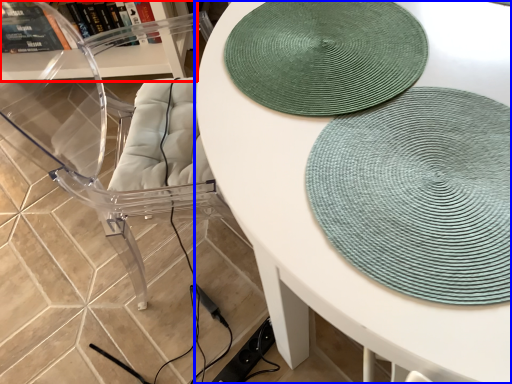
Question: Which point is further to the camera, shelf (highlighted by a red box) or table (highlighted by a blue box)?

Choices:
 (A) shelf
 (B) table

Answer: (A)